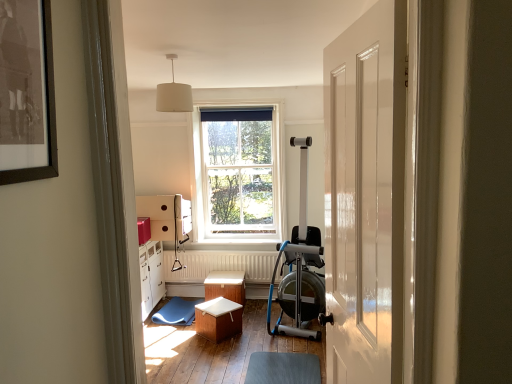
Question: Is wooden stool at center, which ranks as the first stool in front-to-back order, in front of white textured radiator at center?

Choices:
 (A) yes
 (B) no

Answer: (A)

Question: Is wooden stool at center, which ranks as the first stool in front-to-back order, thinner than white textured radiator at center?

Choices:
 (A) no
 (B) yes

Answer: (A)

Question: From a real-world perspective, is wooden stool at center, which ranks as the first stool in front-to-back order, physically above white textured radiator at center?

Choices:
 (A) no
 (B) yes

Answer: (A)

Question: Can you confirm if wooden stool at center, the second stool when ordered from back to front, is positioned to the right of white textured radiator at center?

Choices:
 (A) yes
 (B) no

Answer: (B)

Question: Is wooden stool at center, the second stool when ordered from back to front, positioned beyond the bounds of white textured radiator at center?

Choices:
 (A) no
 (B) yes

Answer: (B)

Question: From a real-world perspective, is wooden stool at center, the second stool when ordered from back to front, under white textured radiator at center?

Choices:
 (A) yes
 (B) no

Answer: (A)

Question: Considering the relative positions of white wooden window at center and wooden stool at center, the second stool when ordered from back to front, in the image provided, is white wooden window at center behind wooden stool at center, the second stool when ordered from back to front,?

Choices:
 (A) yes
 (B) no

Answer: (A)

Question: Is white wooden window at center not within wooden stool at center, the second stool when ordered from back to front?

Choices:
 (A) no
 (B) yes

Answer: (B)

Question: From the image's perspective, is white wooden window at center located above wooden stool at center, which ranks as the first stool in front-to-back order?

Choices:
 (A) yes
 (B) no

Answer: (A)

Question: Is white wooden window at center facing away from wooden stool at center, the second stool when ordered from back to front?

Choices:
 (A) no
 (B) yes

Answer: (A)

Question: Is white wooden window at center at the right side of wooden stool at center, which ranks as the first stool in front-to-back order?

Choices:
 (A) no
 (B) yes

Answer: (B)

Question: From the image's perspective, is white wooden window at center under wooden stool at center, the second stool when ordered from back to front?

Choices:
 (A) no
 (B) yes

Answer: (A)

Question: Considering the relative sizes of white fabric lampshade at upper center and wooden stool at center, which is counted as the 1th stool, starting from the back, in the image provided, is white fabric lampshade at upper center taller than wooden stool at center, which is counted as the 1th stool, starting from the back,?

Choices:
 (A) yes
 (B) no

Answer: (A)